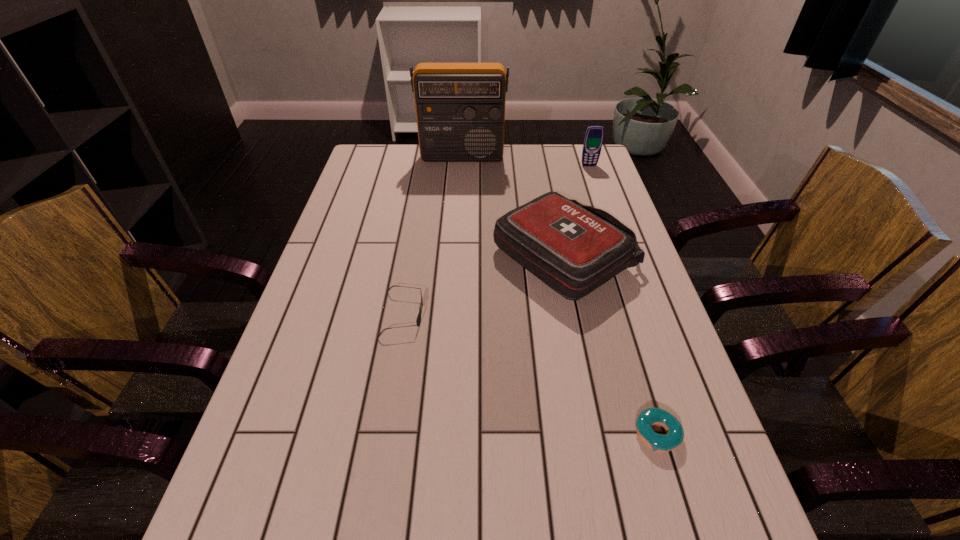
I want to click on free space at the far left corner, so click(x=393, y=156).

Where is `empty space that is in between the fourth shortest object and the radio receiver`? empty space that is in between the fourth shortest object and the radio receiver is located at coordinates point(525,162).

Find the location of `free point between the radio receiver and the nearest object`. free point between the radio receiver and the nearest object is located at coordinates (560, 296).

Identify the location of free spot between the radio receiver and the second shortest object. (432, 236).

Find the location of a particular element. This screenshot has height=540, width=960. vacant space that is in between the first-aid kit and the tallest object is located at coordinates [514, 208].

What are the coordinates of `blank region between the fourth shortest object and the tallest object` in the screenshot? It's located at (525, 162).

At what (x,y) coordinates should I click in order to perform the action: click on free point between the fourth shortest object and the tallest object. Please return your answer as a coordinate pair (x, y). Looking at the image, I should click on (525, 162).

This screenshot has height=540, width=960. Find the location of `free point between the third shortest object and the radio receiver`. free point between the third shortest object and the radio receiver is located at coordinates (514, 208).

Find the location of a particular element. The height and width of the screenshot is (540, 960). vacant area that lies between the second shortest object and the doughnut is located at coordinates (530, 374).

Identify the location of object that is the nearest to the shortest object. (574, 249).